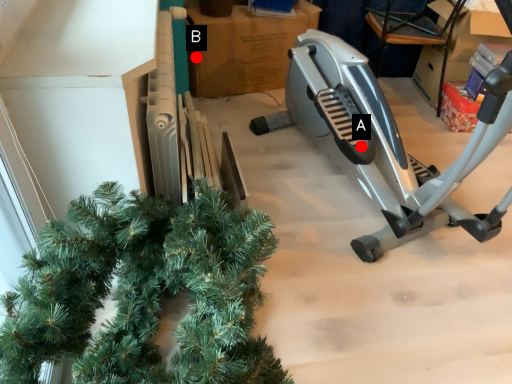
Question: Two points are circled on the image, labeled by A and B beside each circle. Which point is further to the camera?

Choices:
 (A) A is further
 (B) B is further

Answer: (B)